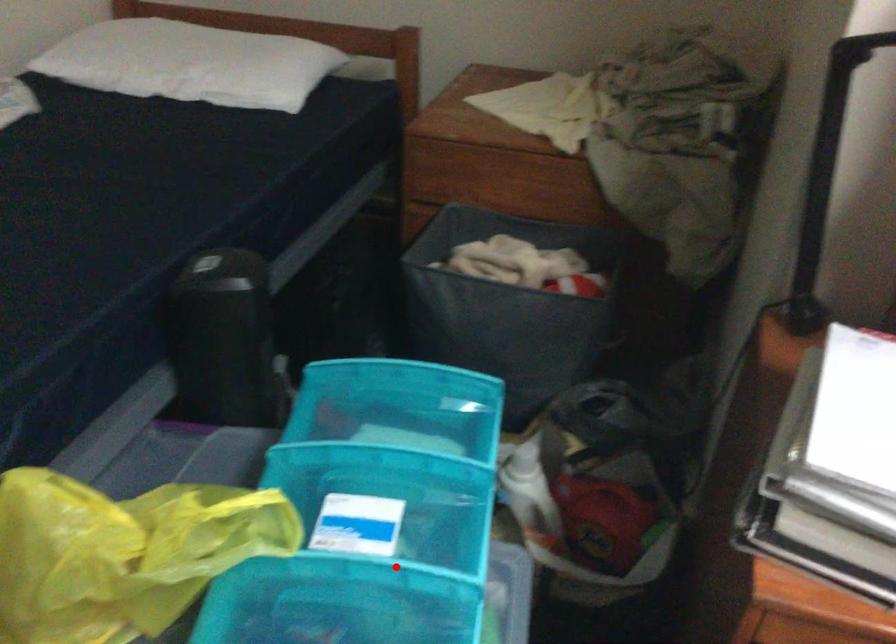
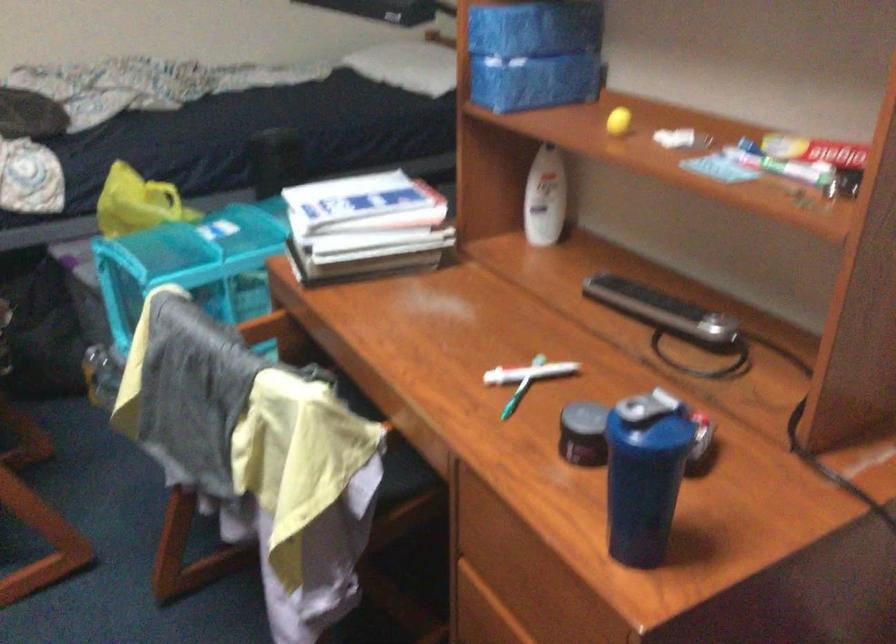
Question: I am providing you with two images of the same scene from different viewpoints. In image1, a red point is highlighted. Considering the same 3D point in image2, which of the following is correct?

Choices:
 (A) It is closer
 (B) It is farther

Answer: (B)